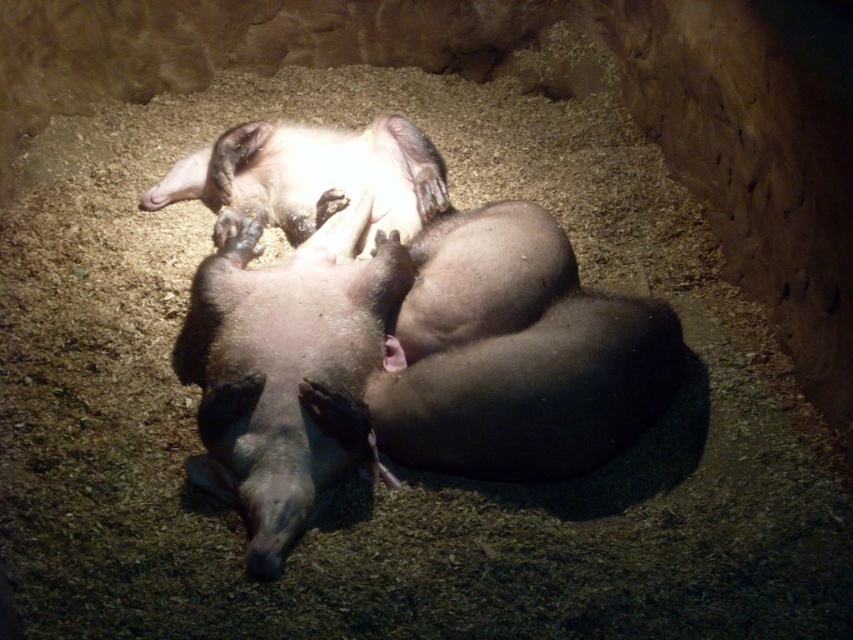
Question: Which point is farther to the camera?

Choices:
 (A) fur-like skin piglet at upper center
 (B) smooth pink piglet at center

Answer: (A)

Question: Is smooth pink piglet at center to the right of fur-like skin piglet at upper center from the viewer's perspective?

Choices:
 (A) yes
 (B) no

Answer: (A)

Question: Is smooth pink piglet at center bigger than fur-like skin piglet at upper center?

Choices:
 (A) no
 (B) yes

Answer: (B)

Question: Which point appears closest to the camera in this image?

Choices:
 (A) (212, 147)
 (B) (231, 346)

Answer: (B)

Question: Can you confirm if smooth pink piglet at center is thinner than fur-like skin piglet at upper center?

Choices:
 (A) yes
 (B) no

Answer: (A)